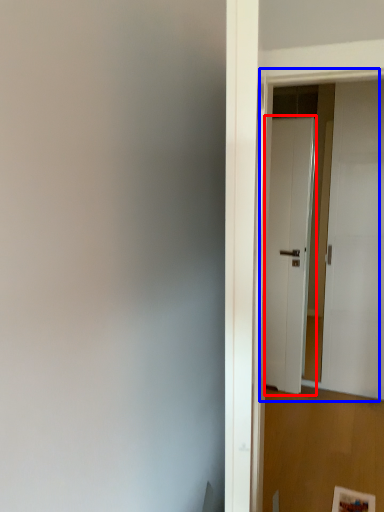
Question: Which point is closer to the camera, door (highlighted by a red box) or door (highlighted by a blue box)?

Choices:
 (A) door
 (B) door

Answer: (B)